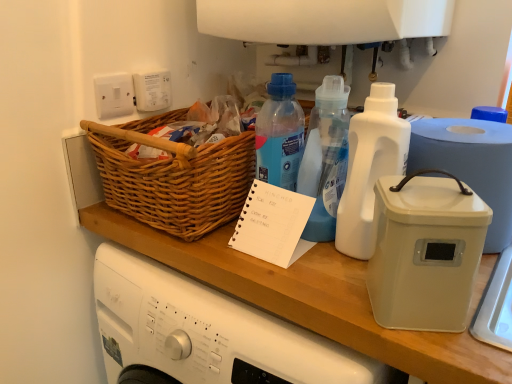
What do you see at coordinates (425, 252) in the screenshot? I see `white plastic container at right` at bounding box center [425, 252].

The height and width of the screenshot is (384, 512). What do you see at coordinates (370, 167) in the screenshot?
I see `white plastic bottle at center-right, which ranks as the 1th bottle in right-to-left order` at bounding box center [370, 167].

Identify the location of white plastic container at right. This screenshot has width=512, height=384. (471, 164).

Where is `woven wood basket at upper left`? woven wood basket at upper left is located at coordinates (173, 177).

Locate an element on the screen. This screenshot has width=512, height=384. white plastic container at right is located at coordinates (425, 252).

Find the location of a particular element. The image size is (512, 384). the 1st bottle above the white plastic container at right (from a real-world perspective) is located at coordinates (325, 157).

Is white plastic bottle at center, the second bottle viewed from the right, far from white plastic container at right?

white plastic bottle at center, the second bottle viewed from the right, is near white plastic container at right, not far away.

From the image's perspective, would you say white plastic bottle at center, the 1th bottle when ordered from left to right, is positioned over white plastic container at right?

Yes, from the image's perspective, white plastic bottle at center, the 1th bottle when ordered from left to right, is over white plastic container at right.

Between woven wood basket at upper left and white plastic bottle at center, the second bottle viewed from the right, which one is positioned in front?

Positioned in front is white plastic bottle at center, the second bottle viewed from the right.

Who is bigger, woven wood basket at upper left or white plastic bottle at center, the second bottle viewed from the right?

woven wood basket at upper left.

How much distance is there between woven wood basket at upper left and white plastic bottle at center, the 1th bottle when ordered from left to right?

8.61 inches.

Can you confirm if woven wood basket at upper left is taller than white plastic bottle at center, the 1th bottle when ordered from left to right?

No, woven wood basket at upper left is not taller than white plastic bottle at center, the 1th bottle when ordered from left to right.

Is white plastic container at right positioned far away from white plastic container at right?

No, white plastic container at right is not far from white plastic container at right.

Is white plastic container at right turned away from white plastic container at right?

No, white plastic container at right is not facing the opposite direction of white plastic container at right.

From a real-world perspective, is white plastic container at right positioned under white plastic container at right based on gravity?

Yes, from a real-world perspective, white plastic container at right is beneath white plastic container at right.

Is white plastic container at right shorter than white plastic container at right?

Correct, white plastic container at right is not as tall as white plastic container at right.

From the picture: Measure the distance between woven wood basket at upper left and white paper notepad at center.

They are 6.15 inches apart.

From the image's perspective, which object appears higher, woven wood basket at upper left or white paper notepad at center?

woven wood basket at upper left appears higher in the image.

Based on their positions, is woven wood basket at upper left located to the left or right of white paper notepad at center?

woven wood basket at upper left is to the left of white paper notepad at center.

How many degrees apart are the facing directions of white plastic container at right and white plastic bottle at center, the second bottle viewed from the right?

90 degrees.

Locate an element on the screen. Image resolution: width=512 pixels, height=384 pixels. the 2nd bottle to the left when counting from the white plastic container at right is located at coordinates (325, 157).

Is white plastic container at right bigger than white plastic bottle at center, the 1th bottle when ordered from left to right?

Indeed, white plastic container at right has a larger size compared to white plastic bottle at center, the 1th bottle when ordered from left to right.

Is white plastic container at right to the left or to the right of white plastic bottle at center, the second bottle viewed from the right, in the image?

white plastic container at right is to the right of white plastic bottle at center, the second bottle viewed from the right.

Which object is further away from the camera, white plastic container at right or white plastic bottle at center-right, the second bottle positioned from the left?

white plastic bottle at center-right, the second bottle positioned from the left.

From the image's perspective, is white plastic container at right beneath white plastic bottle at center-right, the second bottle positioned from the left?

Yes.

Is white plastic container at right not near white plastic bottle at center-right, which ranks as the 1th bottle in right-to-left order?

No, white plastic container at right is not far away from white plastic bottle at center-right, which ranks as the 1th bottle in right-to-left order.

How far apart are white plastic container at right and white plastic bottle at center-right, the second bottle positioned from the left?

white plastic container at right is 4.63 inches from white plastic bottle at center-right, the second bottle positioned from the left.

Consider the image. Would you say white plastic container at right is to the left or to the right of white paper notepad at center in the picture?

From the image, it's evident that white plastic container at right is to the right of white paper notepad at center.

Would you say white plastic container at right contains white paper notepad at center?

No, white paper notepad at center is not a part of white plastic container at right.

How many degrees apart are the facing directions of white plastic container at right and white paper notepad at center?

There is a 27.6-degree angle between the facing directions of white plastic container at right and white paper notepad at center.

From the image's perspective, is white plastic container at right on top of white paper notepad at center?

No, from the image's perspective, white plastic container at right is not above white paper notepad at center.

The width and height of the screenshot is (512, 384). I want to click on kitchen appliance on the right of white plastic bottle at center, the second bottle viewed from the right, so click(425, 252).

At what (x,y) coordinates should I click in order to perform the action: click on the 1st bottle in front of the woven wood basket at upper left. Please return your answer as a coordinate pair (x, y). Looking at the image, I should click on (325, 157).

From the picture: Estimate the real-world distances between objects in this image. Which object is closer to white plastic container at right, white plastic bottle at center-right, which ranks as the 1th bottle in right-to-left order, or white paper notepad at center?

Among the two, white plastic bottle at center-right, which ranks as the 1th bottle in right-to-left order, is located nearer to white plastic container at right.

Estimate the real-world distances between objects in this image. Which object is further from woven wood basket at upper left, white plastic container at right or white plastic container at right?

The object further to woven wood basket at upper left is white plastic container at right.

From the image, which object appears to be farther from white paper notepad at center, white plastic bottle at center-right, the second bottle positioned from the left, or white plastic container at right?

The object further to white paper notepad at center is white plastic container at right.

Based on their spatial positions, is woven wood basket at upper left or white plastic bottle at center, the second bottle viewed from the right, closer to white plastic container at right?

white plastic bottle at center, the second bottle viewed from the right, is closer to white plastic container at right.

When comparing their distances from woven wood basket at upper left, does white plastic container at right or white paper notepad at center seem further?

Among the two, white plastic container at right is located further to woven wood basket at upper left.

Looking at this image, looking at the image, which one is located further to white plastic container at right, white paper notepad at center or white plastic bottle at center, the 1th bottle when ordered from left to right?

Based on the image, white paper notepad at center appears to be further to white plastic container at right.

Estimate the real-world distances between objects in this image. Which object is further from white plastic bottle at center, the second bottle viewed from the right, white plastic container at right or woven wood basket at upper left?

woven wood basket at upper left lies further to white plastic bottle at center, the second bottle viewed from the right, than the other object.

Which object lies further to the anchor point white paper notepad at center, white plastic bottle at center, the 1th bottle when ordered from left to right, or white plastic container at right?

white plastic container at right.

Find the location of a particular element. This screenshot has width=512, height=384. notepad between woven wood basket at upper left and white plastic container at right in the horizontal direction is located at coordinates (273, 224).

The height and width of the screenshot is (384, 512). Find the location of `notepad between woven wood basket at upper left and white plastic bottle at center, the 1th bottle when ordered from left to right, from left to right`. notepad between woven wood basket at upper left and white plastic bottle at center, the 1th bottle when ordered from left to right, from left to right is located at coordinates (273, 224).

Identify the location of notepad between woven wood basket at upper left and white plastic bottle at center-right, the second bottle positioned from the left. The width and height of the screenshot is (512, 384). (273, 224).

Where is `kitchen appliance between white plastic bottle at center, the 1th bottle when ordered from left to right, and white plastic container at right from left to right`? This screenshot has height=384, width=512. kitchen appliance between white plastic bottle at center, the 1th bottle when ordered from left to right, and white plastic container at right from left to right is located at coordinates (425, 252).